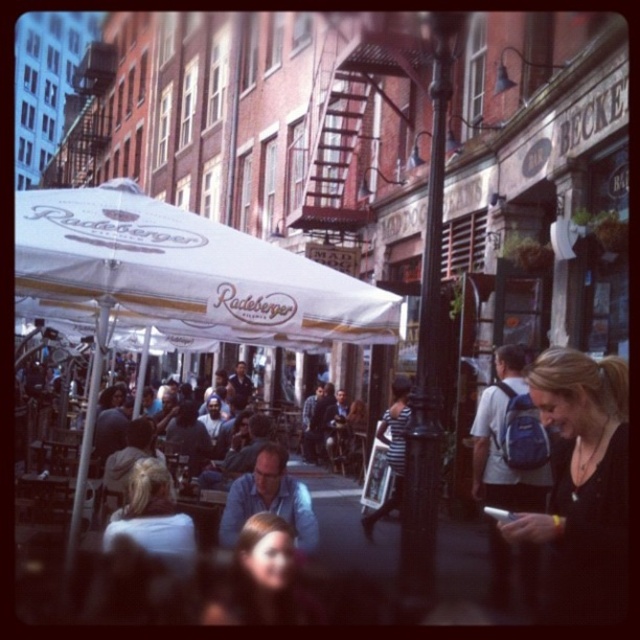
Question: Considering the real-world distances, which object is farthest from the white fabric canopy at center?

Choices:
 (A) black fabric backpack at lower right
 (B) white fabric umbrella at center

Answer: (A)

Question: Considering the relative positions of white fabric umbrella at center and white fabric canopy at center in the image provided, where is white fabric umbrella at center located with respect to white fabric canopy at center?

Choices:
 (A) left
 (B) right

Answer: (A)

Question: Is black fabric backpack at lower right above black metal pole at center?

Choices:
 (A) yes
 (B) no

Answer: (B)

Question: Which point is farther to the camera?

Choices:
 (A) (164, 536)
 (B) (109, 232)
 (C) (547, 371)

Answer: (C)

Question: Is white fabric umbrella at center to the right of blonde hair at center from the viewer's perspective?

Choices:
 (A) yes
 (B) no

Answer: (A)

Question: Which point appears closest to the camera in this image?

Choices:
 (A) (552, 616)
 (B) (147, 472)
 (C) (236, 296)
 (D) (164, 282)

Answer: (D)